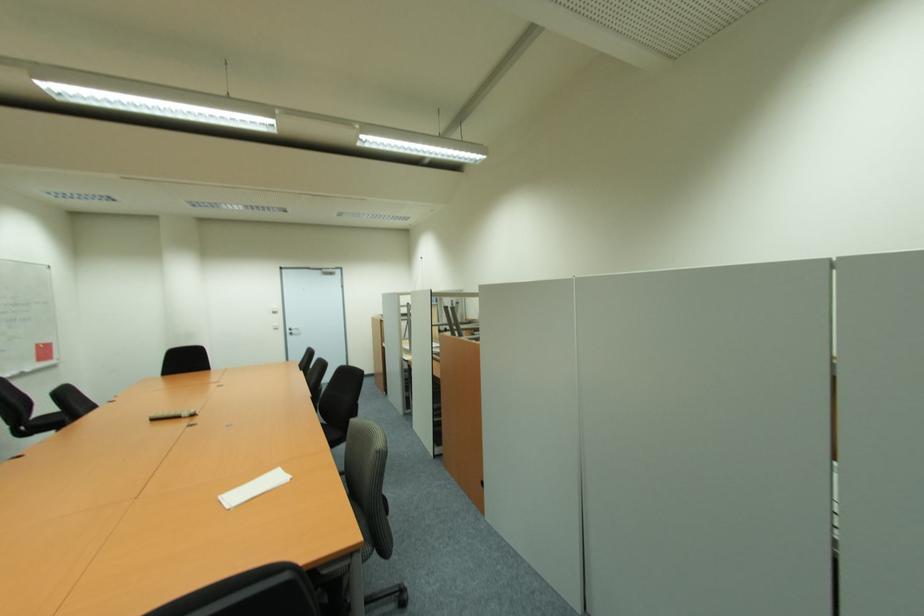
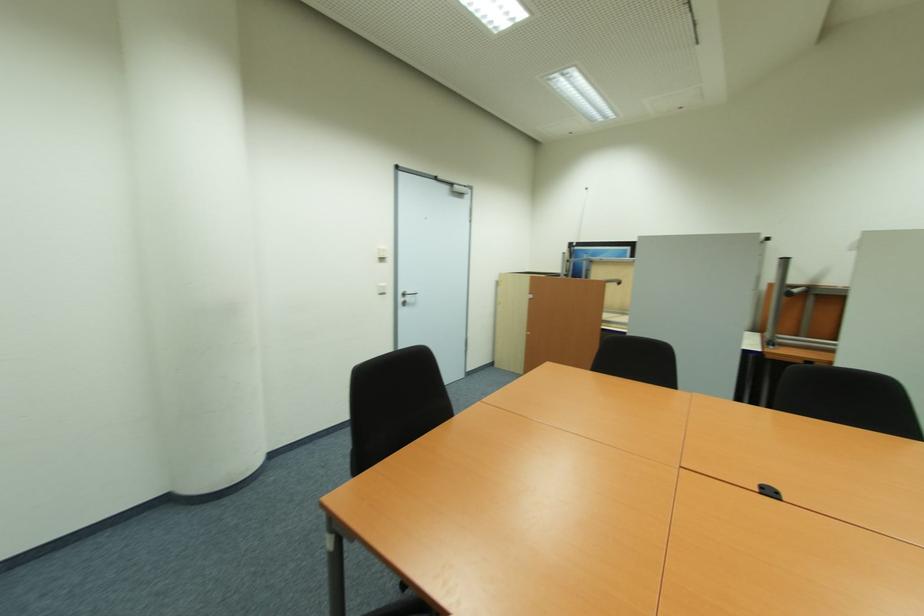
Where in the second image is the point corresponding to pixel 278 313 from the first image?

(385, 260)